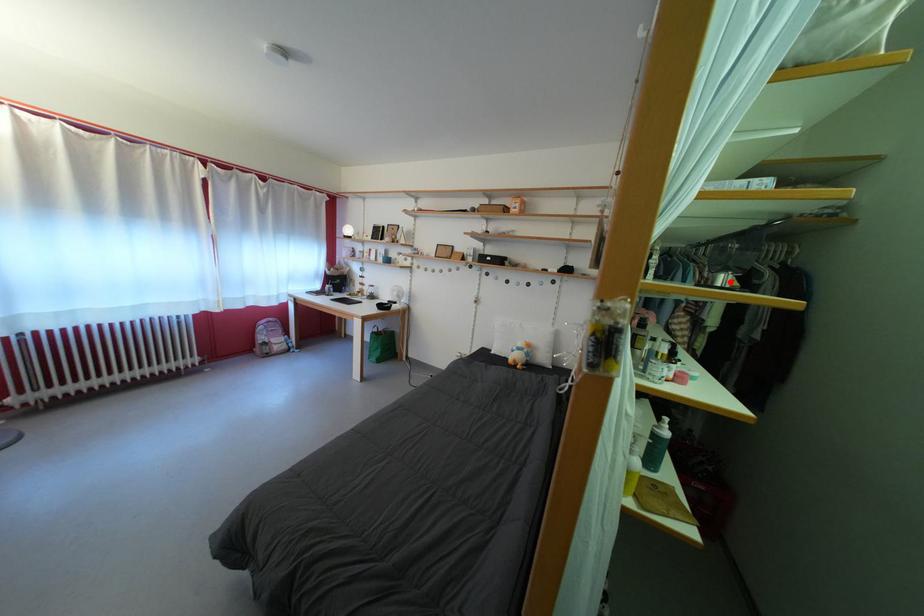
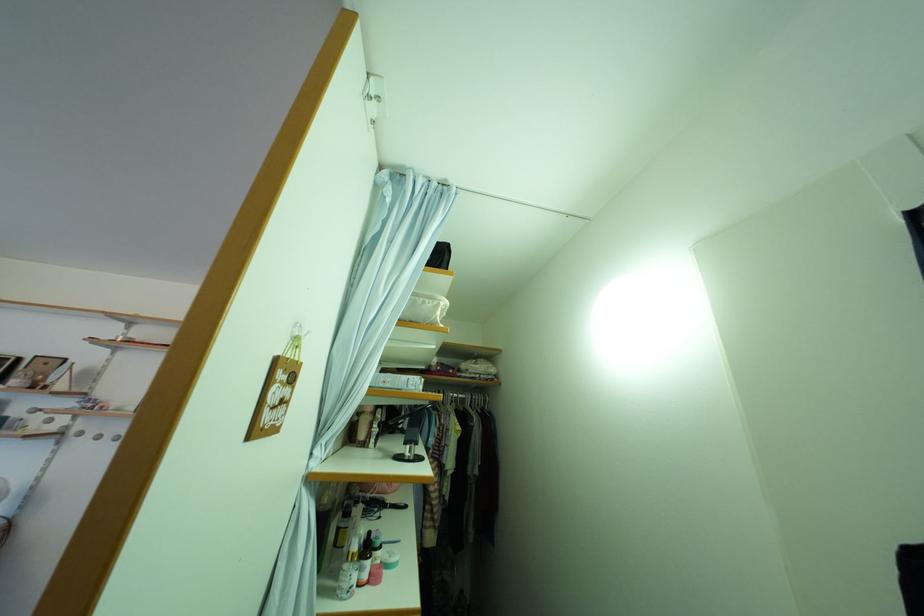
In the second image, find the point that corresponds to the highlighted location in the first image.

(417, 454)